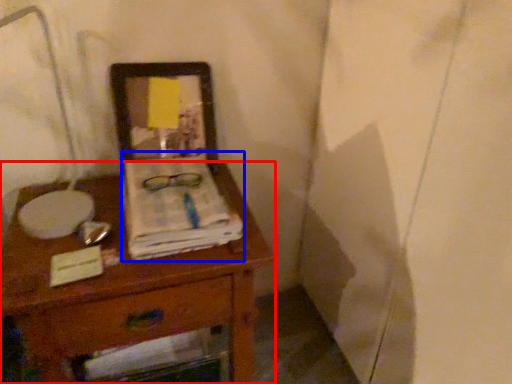
Question: Which point is closer to the camera, desk (highlighted by a red box) or magazine (highlighted by a blue box)?

Choices:
 (A) desk
 (B) magazine

Answer: (A)